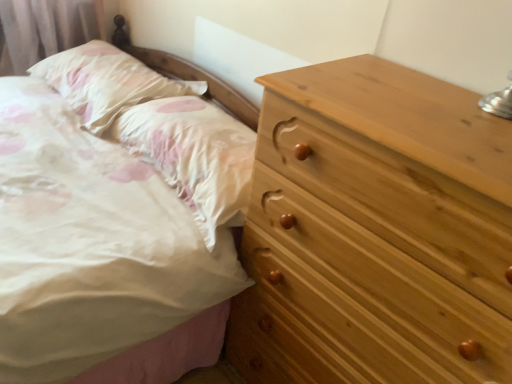
Question: Can you confirm if white satin pillow at upper left, the 1th pillow viewed from the left, is thinner than white satin pillow at upper left, which appears as the 1th pillow when viewed from the right?

Choices:
 (A) yes
 (B) no

Answer: (A)

Question: Is white satin pillow at upper left, the 1th pillow viewed from the left, taller than white satin pillow at upper left, which appears as the 1th pillow when viewed from the right?

Choices:
 (A) yes
 (B) no

Answer: (B)

Question: Is white satin pillow at upper left, which appears as the 1th pillow when viewed from the right, at the back of white satin pillow at upper left, acting as the 2th pillow starting from the right?

Choices:
 (A) no
 (B) yes

Answer: (A)

Question: Are white satin pillow at upper left, acting as the 2th pillow starting from the right, and white satin pillow at upper left, which appears as the 1th pillow when viewed from the right, far apart?

Choices:
 (A) no
 (B) yes

Answer: (A)

Question: From a real-world perspective, is white satin pillow at upper left, the 1th pillow viewed from the left, located higher than white satin pillow at upper left, which is counted as the 2th pillow, starting from the left?

Choices:
 (A) yes
 (B) no

Answer: (A)

Question: Visually, is white satin pillow at upper left, the 1th pillow viewed from the left, positioned to the left or to the right of natural wood chest of drawers at right?

Choices:
 (A) left
 (B) right

Answer: (A)

Question: Which is correct: white satin pillow at upper left, the 1th pillow viewed from the left, is inside natural wood chest of drawers at right, or outside of it?

Choices:
 (A) outside
 (B) inside

Answer: (A)

Question: From the image's perspective, is white satin pillow at upper left, acting as the 2th pillow starting from the right, above or below natural wood chest of drawers at right?

Choices:
 (A) below
 (B) above

Answer: (B)

Question: Considering the positions of white satin pillow at upper left, acting as the 2th pillow starting from the right, and natural wood chest of drawers at right in the image, is white satin pillow at upper left, acting as the 2th pillow starting from the right, taller or shorter than natural wood chest of drawers at right?

Choices:
 (A) short
 (B) tall

Answer: (A)

Question: From the image's perspective, is natural wood chest of drawers at right positioned above or below white satin pillow at upper left, acting as the 2th pillow starting from the right?

Choices:
 (A) below
 (B) above

Answer: (A)

Question: Visually, is natural wood chest of drawers at right positioned to the left or to the right of white satin pillow at upper left, the 1th pillow viewed from the left?

Choices:
 (A) right
 (B) left

Answer: (A)

Question: Looking at the image, does natural wood chest of drawers at right seem bigger or smaller compared to white satin pillow at upper left, the 1th pillow viewed from the left?

Choices:
 (A) big
 (B) small

Answer: (A)

Question: Relative to white satin pillow at upper left, acting as the 2th pillow starting from the right, is natural wood chest of drawers at right in front or behind?

Choices:
 (A) front
 (B) behind

Answer: (A)

Question: In the image, is white satin pillow at upper left, the 1th pillow viewed from the left, positioned in front of or behind white satin pillow at upper left, which appears as the 1th pillow when viewed from the right?

Choices:
 (A) behind
 (B) front

Answer: (A)

Question: Is point (131, 62) closer or farther from the camera than point (210, 162)?

Choices:
 (A) closer
 (B) farther

Answer: (B)